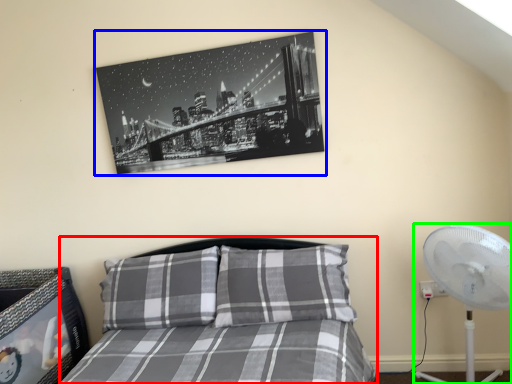
Question: Which object is the closest to the bed (highlighted by a red box)? Choose among these: picture frame (highlighted by a blue box) or mechanical fan (highlighted by a green box).

Choices:
 (A) picture frame
 (B) mechanical fan

Answer: (A)